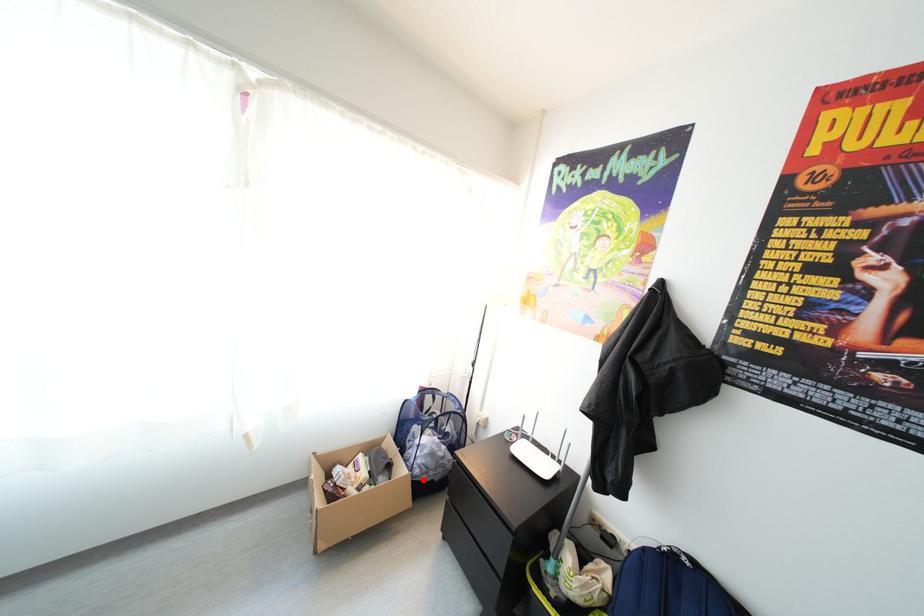
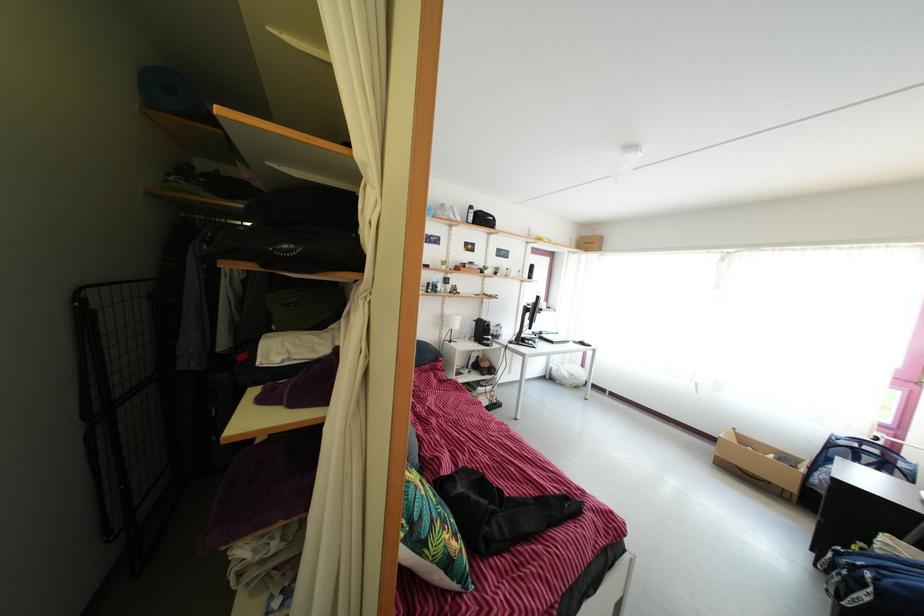
The point at the highlighted location is marked in the first image. Where is the corresponding point in the second image?

(821, 488)